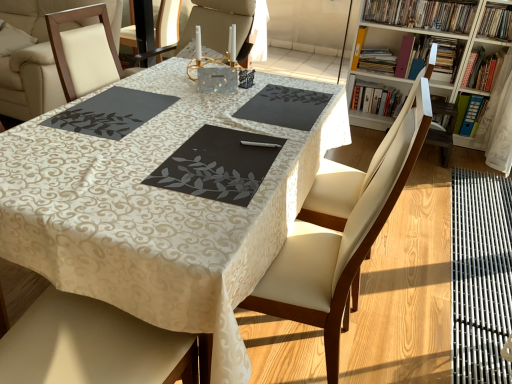
Question: Is leather seat at center in front of wooden bookcase at upper right?

Choices:
 (A) no
 (B) yes

Answer: (B)

Question: From a real-world perspective, is leather seat at center physically above wooden bookcase at upper right?

Choices:
 (A) yes
 (B) no

Answer: (B)

Question: Is leather seat at center to the right of wooden bookcase at upper right from the viewer's perspective?

Choices:
 (A) yes
 (B) no

Answer: (B)

Question: Is leather seat at center looking in the opposite direction of wooden bookcase at upper right?

Choices:
 (A) no
 (B) yes

Answer: (A)

Question: From the image's perspective, is leather seat at center on top of wooden bookcase at upper right?

Choices:
 (A) no
 (B) yes

Answer: (A)

Question: Which is correct: wooden bookcase at upper right is inside black matte placemat at center, positioned as the third place mat in left-to-right order, or outside of it?

Choices:
 (A) outside
 (B) inside

Answer: (A)

Question: Considering the relative positions of wooden bookcase at upper right and black matte placemat at center, the 1th place mat when ordered from right to left, in the image provided, is wooden bookcase at upper right to the left or to the right of black matte placemat at center, the 1th place mat when ordered from right to left,?

Choices:
 (A) left
 (B) right

Answer: (B)

Question: Is wooden bookcase at upper right in front of or behind black matte placemat at center, the 1th place mat when ordered from right to left, in the image?

Choices:
 (A) front
 (B) behind

Answer: (B)

Question: From the image's perspective, is wooden bookcase at upper right located above or below black matte placemat at center, positioned as the third place mat in left-to-right order?

Choices:
 (A) below
 (B) above

Answer: (B)

Question: Choose the correct answer: Is black matte placemat at center, positioned as the third place mat in left-to-right order, inside hardcover books at upper right, the 7th book from the right, or outside it?

Choices:
 (A) outside
 (B) inside

Answer: (A)

Question: Is black matte placemat at center, the 1th place mat when ordered from right to left, to the left or to the right of hardcover books at upper right, marked as the third book in a left-to-right arrangement, in the image?

Choices:
 (A) left
 (B) right

Answer: (A)

Question: Is black matte placemat at center, the 1th place mat when ordered from right to left, bigger or smaller than hardcover books at upper right, marked as the third book in a left-to-right arrangement?

Choices:
 (A) big
 (B) small

Answer: (B)

Question: From the image's perspective, is black matte placemat at center, positioned as the third place mat in left-to-right order, located above or below hardcover books at upper right, marked as the third book in a left-to-right arrangement?

Choices:
 (A) above
 (B) below

Answer: (B)

Question: Considering the positions of blue plastic folder at upper right, marked as the 3th book in a right-to-left arrangement, and yellow paper at upper right, placed as the 9th book when sorted from right to left, in the image, is blue plastic folder at upper right, marked as the 3th book in a right-to-left arrangement, taller or shorter than yellow paper at upper right, placed as the 9th book when sorted from right to left,?

Choices:
 (A) tall
 (B) short

Answer: (A)

Question: From a real-world perspective, is blue plastic folder at upper right, marked as the 3th book in a right-to-left arrangement, above or below yellow paper at upper right, which is the 1th book from left to right?

Choices:
 (A) above
 (B) below

Answer: (B)